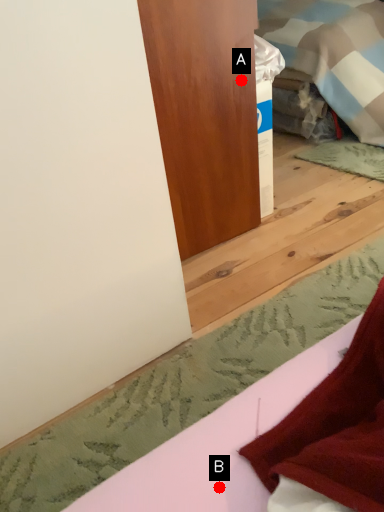
Question: Two points are circled on the image, labeled by A and B beside each circle. Which point appears closest to the camera in this image?

Choices:
 (A) A is closer
 (B) B is closer

Answer: (B)